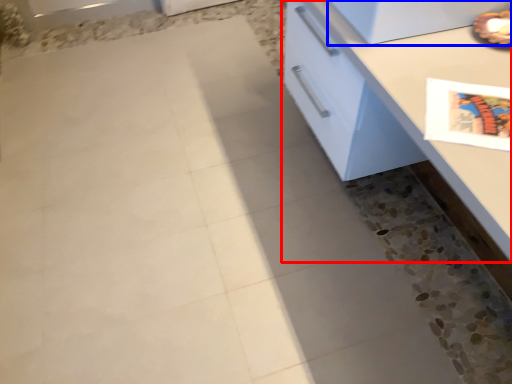
Question: Which object appears farthest to the camera in this image, countertop (highlighted by a red box) or appliance (highlighted by a blue box)?

Choices:
 (A) countertop
 (B) appliance

Answer: (B)